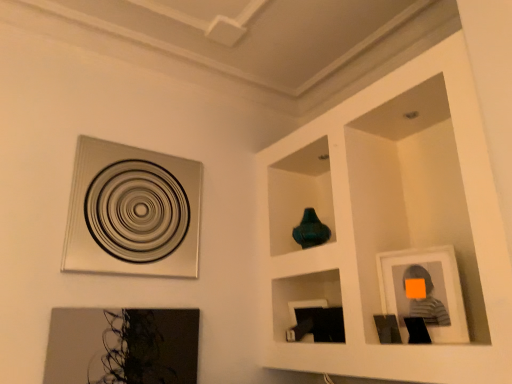
Question: Looking at their shapes, would you say metallic silver picture frame at upper left, acting as the third picture frame starting from the right, is wider or thinner than matte gray picture frame at right, which is the 3th picture frame in left-to-right order?

Choices:
 (A) wide
 (B) thin

Answer: (A)

Question: Considering the positions of metallic silver picture frame at upper left, acting as the third picture frame starting from the right, and matte gray picture frame at right, which is the 3th picture frame in left-to-right order, in the image, is metallic silver picture frame at upper left, acting as the third picture frame starting from the right, taller or shorter than matte gray picture frame at right, which is the 3th picture frame in left-to-right order,?

Choices:
 (A) short
 (B) tall

Answer: (B)

Question: Based on their relative distances, which object is nearer to the matte black picture frame at lower left, the 2th picture frame in the right-to-left sequence?

Choices:
 (A) metallic silver picture frame at upper left, the first picture frame in the left-to-right sequence
 (B) matte gray picture frame at right, which is the 3th picture frame in left-to-right order

Answer: (A)

Question: Estimate the real-world distances between objects in this image. Which object is closer to the matte gray picture frame at right, the first picture frame when ordered from right to left?

Choices:
 (A) metallic silver picture frame at upper left, acting as the third picture frame starting from the right
 (B) matte black picture frame at lower left, the 2th picture frame in the right-to-left sequence

Answer: (B)